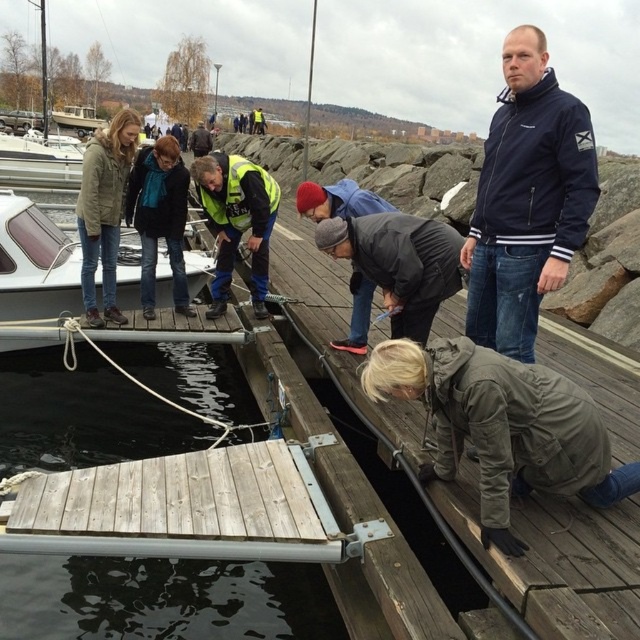
Question: Estimate the real-world distances between objects in this image. Which object is closer to the matte black jacket at upper left?

Choices:
 (A) white glossy boat at upper left
 (B) gray matte jacket at lower right

Answer: (A)

Question: Is reflective yellow safety vest at center above matte green jacket at upper left?

Choices:
 (A) yes
 (B) no

Answer: (B)

Question: Is dark wood water at lower left bigger than matte green jacket at upper left?

Choices:
 (A) yes
 (B) no

Answer: (B)

Question: Which point appears farthest from the camera in this image?

Choices:
 (A) (470, 321)
 (B) (396, 362)
 (C) (24, 173)

Answer: (C)

Question: Is white glossy boat at upper left to the left of matte green jacket at upper left from the viewer's perspective?

Choices:
 (A) yes
 (B) no

Answer: (A)

Question: Which object appears closest to the camera in this image?

Choices:
 (A) navy blue jacket at upper right
 (B) dark wood water at lower left

Answer: (A)